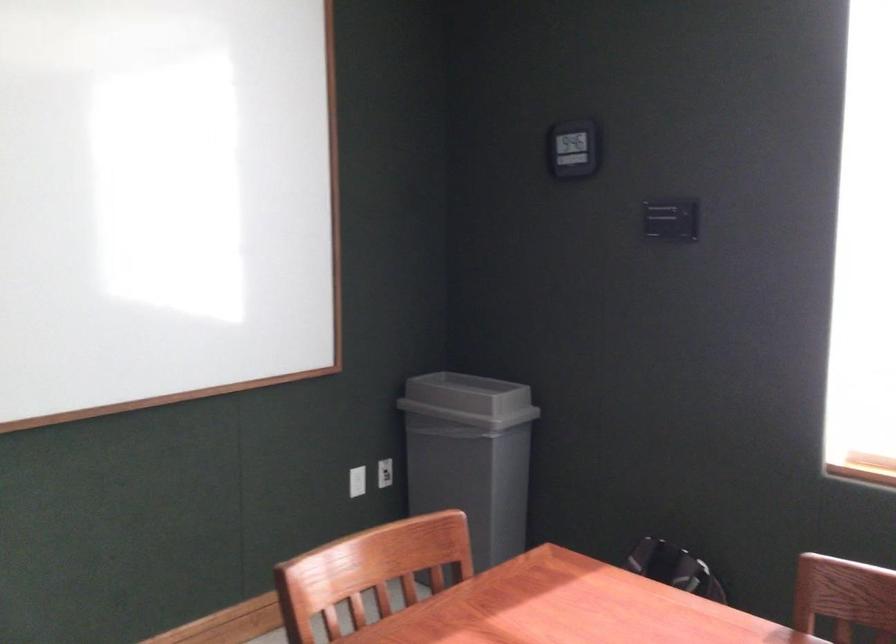
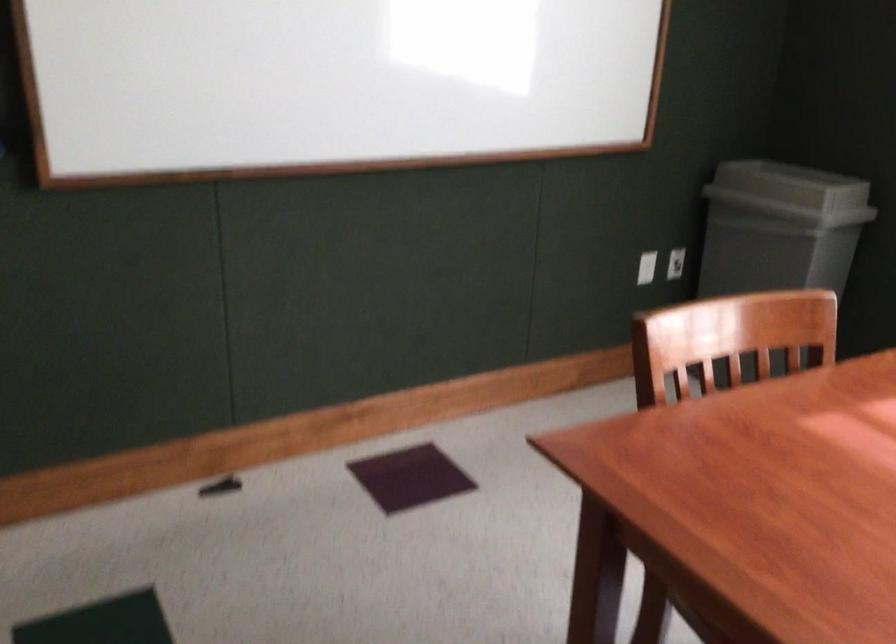
Which direction would the cameraman need to move to produce the second image?

The cameraman walked toward left, forward.